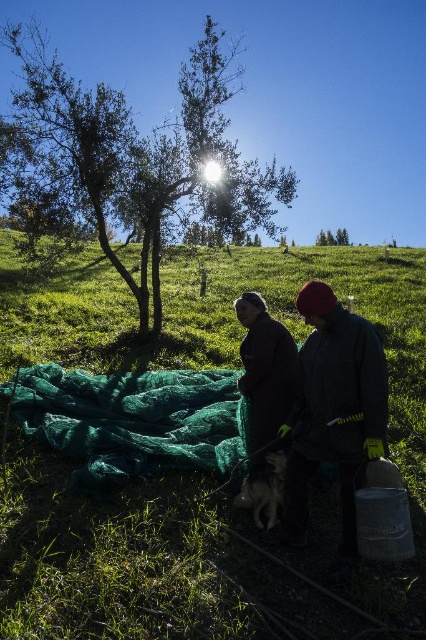
You are standing on the grassy hillside and want to walk towards the green netting at upper center without stepping on the dark brown leather jacket at center. Which direction should you move relative to the jacket?

You should move to the right of the dark brown leather jacket at center to reach the green netting at upper center since the jacket is to the left of the netting.

You are a photographer trying to capture a closeup shot of the dark green fabric at center and the white fur dog at center. Your camera has a minimum focusing distance of 24 inches. Can you take the photo without moving either object?

The dark green fabric at center and white fur dog at center are 20.98 inches apart, which is less than the camera minimum focusing distance of 24 inches. Therefore, you cannot take the photo without moving either object.